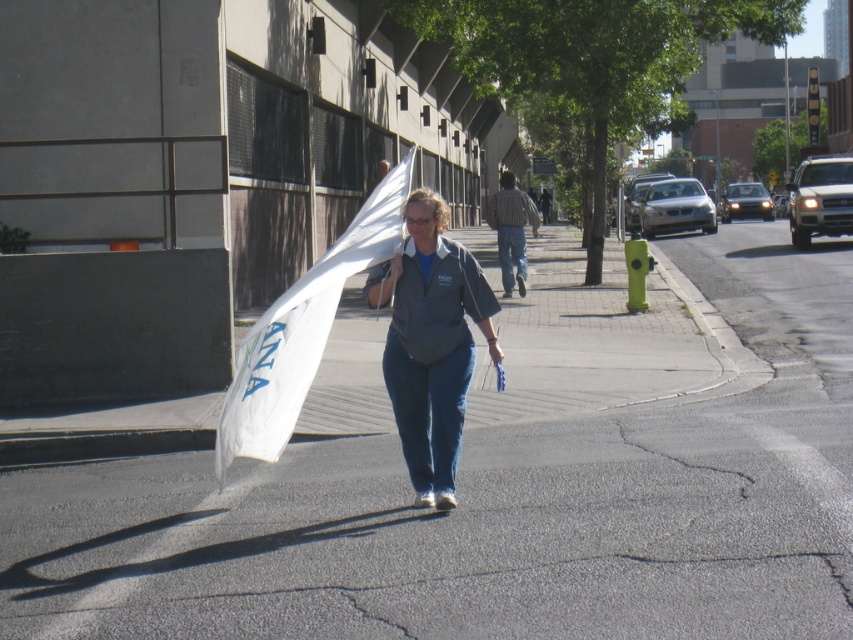
Is asphalt at center below matte gray shirt at center?

Yes, asphalt at center is below matte gray shirt at center.

Who is higher up, asphalt at center or matte gray shirt at center?

matte gray shirt at center is higher up.

Which is in front, point (4, 472) or point (416, 266)?

Point (416, 266) is in front.

At what (x,y) coordinates should I click in order to perform the action: click on asphalt at center. Please return your answer as a coordinate pair (x, y). Looking at the image, I should click on (491, 477).